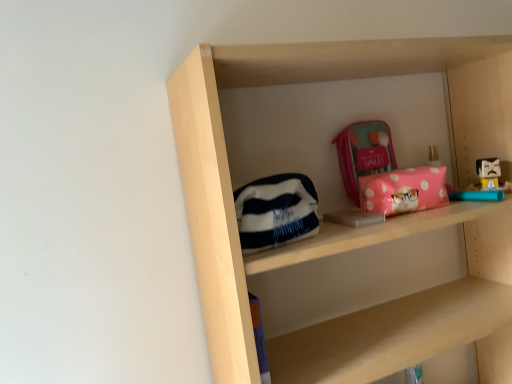
Question: Considering the positions of matte pink pouch at upper center, placed as the 2th pouch when sorted from front to back, and white fleece pouch at center, which appears as the 2th pouch when viewed from the right, in the image, is matte pink pouch at upper center, placed as the 2th pouch when sorted from front to back, bigger or smaller than white fleece pouch at center, which appears as the 2th pouch when viewed from the right,?

Choices:
 (A) small
 (B) big

Answer: (A)

Question: From their relative heights in the image, would you say matte pink pouch at upper center, which is the first pouch from top to bottom, is taller or shorter than white fleece pouch at center, which appears as the 2th pouch when viewed from the right?

Choices:
 (A) short
 (B) tall

Answer: (A)

Question: Considering the real-world distances, which object is closest to the white fleece pouch at center, marked as the 2th pouch in a back-to-front arrangement?

Choices:
 (A) matte pink pouch at upper center, the 2th pouch positioned from the bottom
 (B) pink polka dot pouch at center

Answer: (B)

Question: Based on their relative distances, which object is farther from the white fleece pouch at center, marked as the 2th pouch in a back-to-front arrangement?

Choices:
 (A) matte pink pouch at upper center, placed as the 2th pouch when sorted from front to back
 (B) pink polka dot pouch at center

Answer: (A)